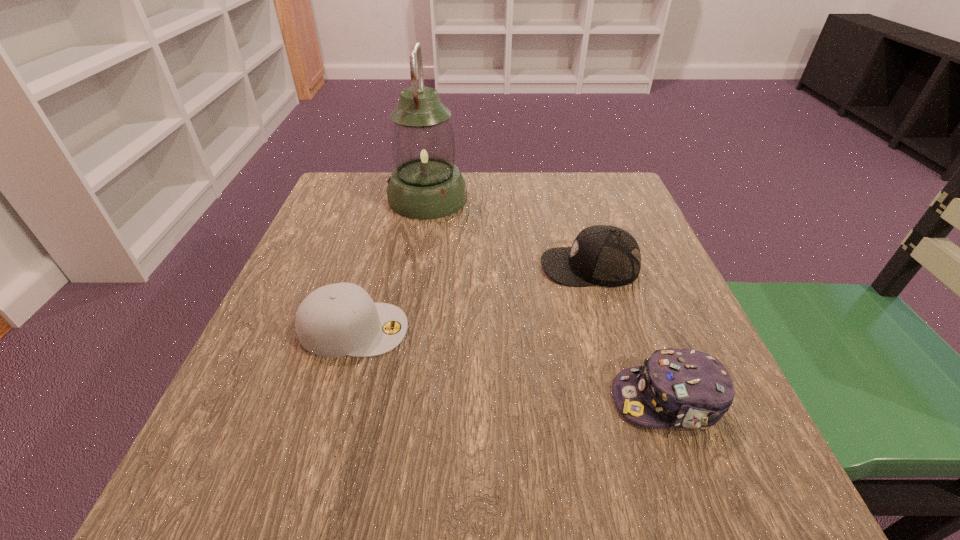
Locate an element on the screen. lantern is located at coordinates (426, 184).

I want to click on the tallest object, so click(x=426, y=184).

The width and height of the screenshot is (960, 540). I want to click on the farthest headwear, so click(x=603, y=255).

Locate an element on the screen. The height and width of the screenshot is (540, 960). the third farthest object is located at coordinates (336, 320).

The width and height of the screenshot is (960, 540). I want to click on the leftmost headwear, so click(336, 320).

Image resolution: width=960 pixels, height=540 pixels. I want to click on the nearest object, so click(x=684, y=388).

This screenshot has height=540, width=960. I want to click on vacant space located on the right of the tallest object, so click(556, 198).

Find the location of a particular element. free space located on the front-facing side of the second farthest object is located at coordinates (365, 266).

Identify the location of free space located on the front-facing side of the second farthest object. (516, 266).

Where is `vacant space located 0.390m on the front-facing side of the second farthest object`? Image resolution: width=960 pixels, height=540 pixels. vacant space located 0.390m on the front-facing side of the second farthest object is located at coordinates (349, 266).